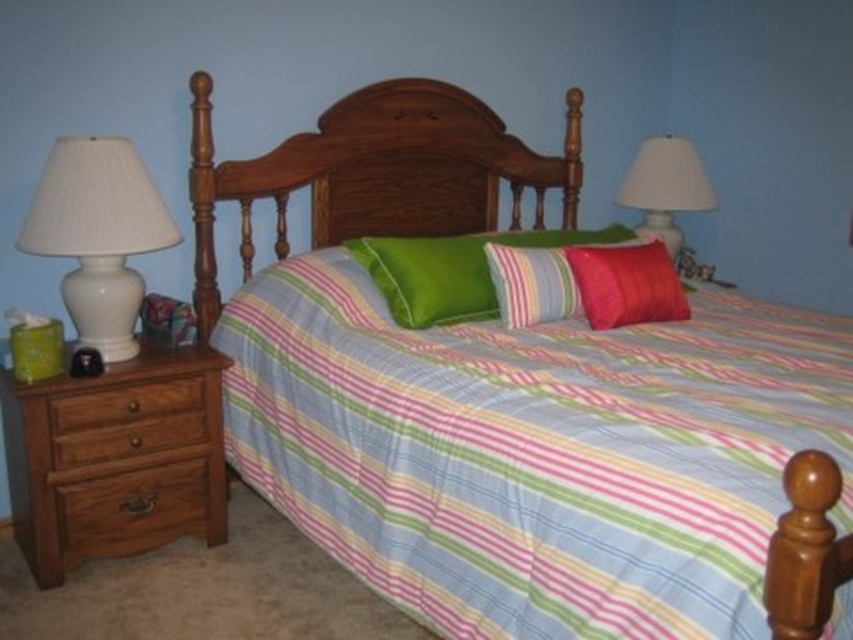
Who is taller, green matte pillow at center or brown wooden drawer at left?

Standing taller between the two is green matte pillow at center.

Is green matte pillow at center behind brown wooden drawer at left?

Yes, green matte pillow at center is behind brown wooden drawer at left.

Is point (384, 298) closer to camera compared to point (109, 444)?

No, (384, 298) is behind (109, 444).

You are a GUI agent. You are given a task and a screenshot of the screen. Output one action in this format:
    pyautogui.click(x=<x>, y=<y>)
    Task: Click on the green matte pillow at center
    This screenshot has width=853, height=640.
    Given the screenshot: What is the action you would take?
    pyautogui.click(x=453, y=269)

Which is above, white ceramic lamp at upper right or brown wood drawer at left?

white ceramic lamp at upper right is higher up.

Is point (614, 195) behind point (142, 401)?

Yes, point (614, 195) is farther from viewer.

Locate an element on the screen. white ceramic lamp at upper right is located at coordinates (665, 188).

Is point (61, 540) less distant than point (125, 448)?

Yes, it is.

Is brown wood dresser at left bigger than brown wooden drawer at left?

Indeed, brown wood dresser at left has a larger size compared to brown wooden drawer at left.

Image resolution: width=853 pixels, height=640 pixels. What do you see at coordinates (115, 458) in the screenshot?
I see `brown wood dresser at left` at bounding box center [115, 458].

Locate an element on the screen. Image resolution: width=853 pixels, height=640 pixels. brown wood dresser at left is located at coordinates [x=115, y=458].